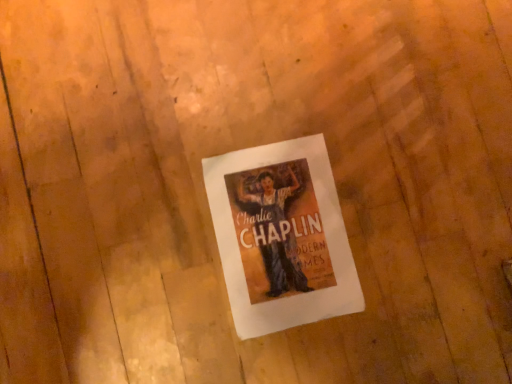
Where is `white paper at center`? white paper at center is located at coordinates (281, 236).

The width and height of the screenshot is (512, 384). Describe the element at coordinates (281, 236) in the screenshot. I see `white paper at center` at that location.

Locate an element on the screen. The image size is (512, 384). white paper at center is located at coordinates (281, 236).